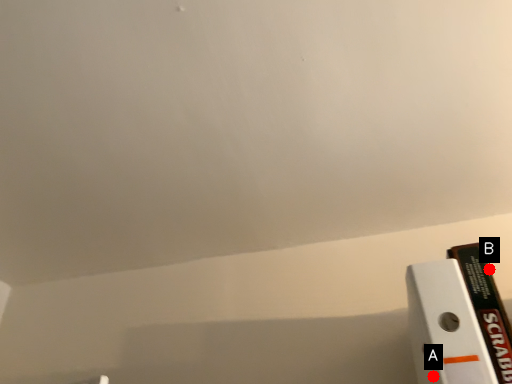
Question: Two points are circled on the image, labeled by A and B beside each circle. Which point appears closest to the camera in this image?

Choices:
 (A) A is closer
 (B) B is closer

Answer: (A)